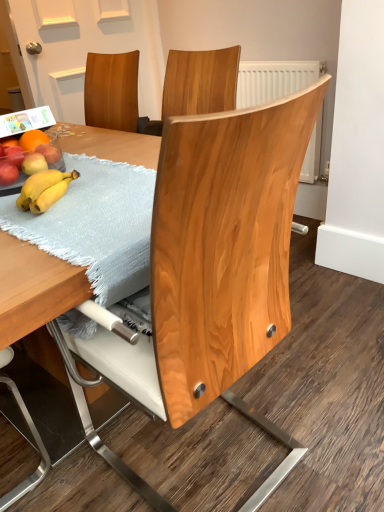
What are the coordinates of `empty space that is ontop of light blue textured placemat at table (from a real-world perspective)` in the screenshot? It's located at pyautogui.click(x=85, y=185).